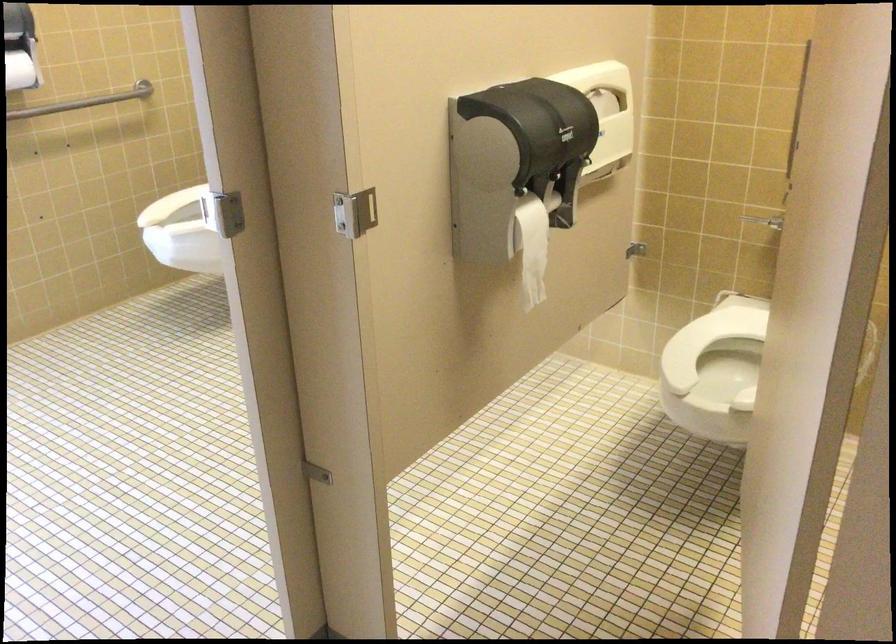
The height and width of the screenshot is (644, 896). Describe the element at coordinates (531, 249) in the screenshot. I see `the toilet paper roll` at that location.